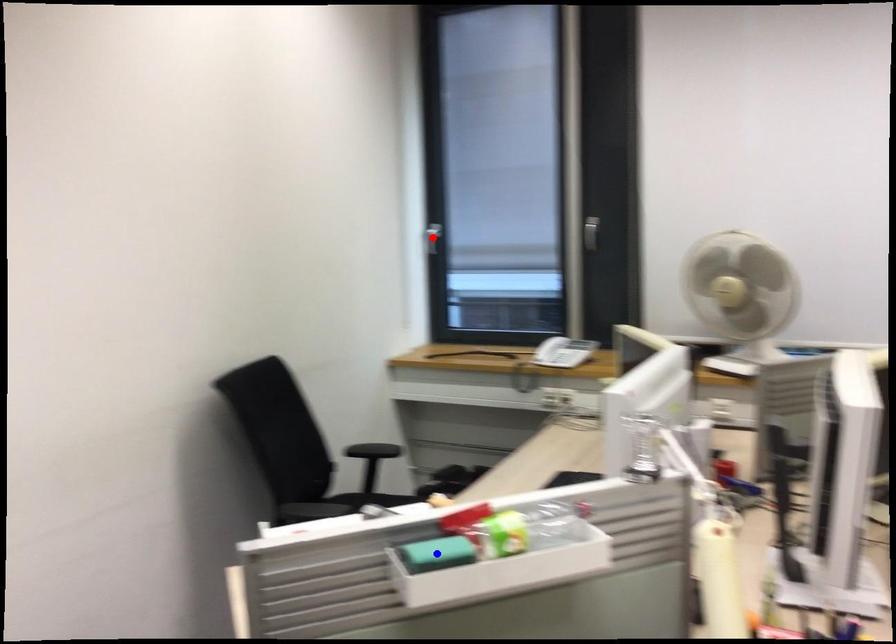
Question: Which of the two points in the image is closer to the camera?

Choices:
 (A) Blue point is closer.
 (B) Red point is closer.

Answer: (A)